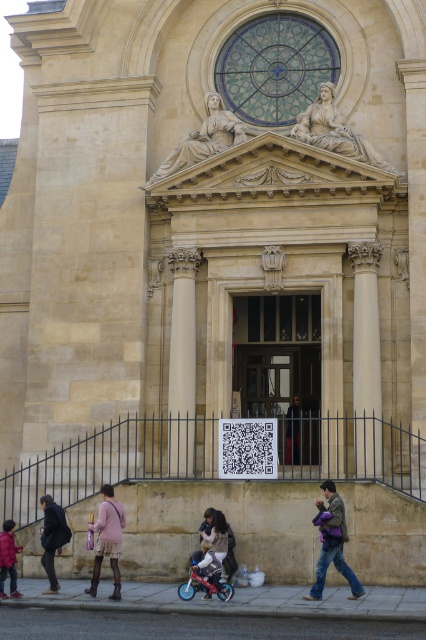
Question: Can you confirm if white marble column at center is positioned below jeans at lower right?

Choices:
 (A) yes
 (B) no

Answer: (B)

Question: Which is nearer to the matte stone statue at center?

Choices:
 (A) white marble statue at upper center
 (B) dark blue jacket at lower left
 (C) metallic blue baby carriage at lower center

Answer: (A)

Question: Which point is farther to the camera?

Choices:
 (A) (360, 400)
 (B) (65, 524)
 (C) (11, 584)

Answer: (A)

Question: Which object is farther from the camera taking this photo?

Choices:
 (A) dark blue jacket at lower left
 (B) matte stone statue at center
 (C) matte black jacket at lower center

Answer: (B)

Question: Can you confirm if white marble statue at upper center is positioned to the left of dark brown leather jacket at center?

Choices:
 (A) no
 (B) yes

Answer: (A)

Question: Where is pink fabric skirt at lower left located in relation to metallic blue baby carriage at lower center in the image?

Choices:
 (A) above
 (B) below

Answer: (A)